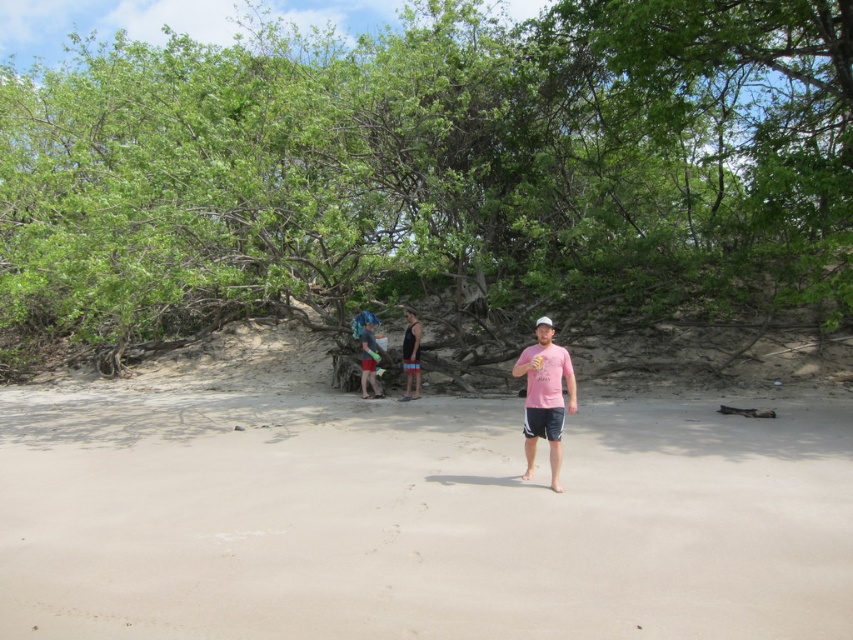
Question: Does light beige sand at center have a larger size compared to black tank top at center?

Choices:
 (A) no
 (B) yes

Answer: (B)

Question: Can you confirm if green leafy tree at center is positioned below light beige sand at center?

Choices:
 (A) no
 (B) yes

Answer: (A)

Question: Does light beige sand at center lie behind blue fabric bag at center?

Choices:
 (A) no
 (B) yes

Answer: (A)

Question: Which object is farther from the camera taking this photo?

Choices:
 (A) blue fabric bag at center
 (B) pink cotton t-shirt at center
 (C) black tank top at center

Answer: (A)

Question: Which point is farther from the camera taking this photo?

Choices:
 (A) (538, 595)
 (B) (556, 378)
 (C) (86, 125)
 (D) (415, 372)

Answer: (C)

Question: Which object appears farthest from the camera in this image?

Choices:
 (A) light beige sand at center
 (B) pink cotton t-shirt at center

Answer: (B)